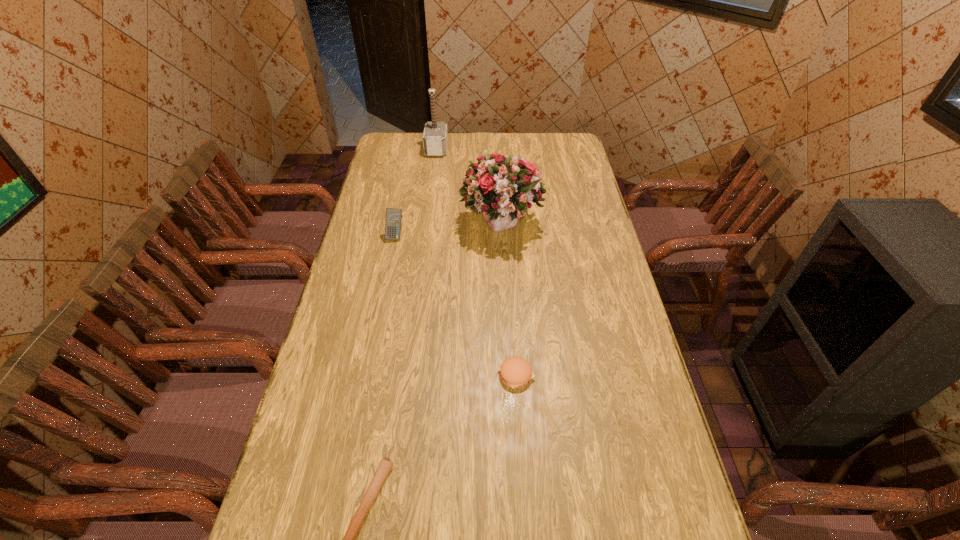
Locate an element on the screen. The width and height of the screenshot is (960, 540). object situated at the far edge is located at coordinates pos(435,137).

Find the location of a particular element. Image resolution: width=960 pixels, height=540 pixels. object that is at the left edge is located at coordinates (393, 219).

Where is `vacant space at the far edge of the desktop`? Image resolution: width=960 pixels, height=540 pixels. vacant space at the far edge of the desktop is located at coordinates (457, 150).

In the image, there is a desktop. Where is `vacant region at the left edge`? Image resolution: width=960 pixels, height=540 pixels. vacant region at the left edge is located at coordinates (293, 498).

Find the location of a particular element. The width and height of the screenshot is (960, 540). vacant space at the right edge is located at coordinates (575, 250).

Image resolution: width=960 pixels, height=540 pixels. In the image, there is a desktop. In order to click on blank space at the far right corner in this screenshot , I will do `click(557, 147)`.

Where is `free space that is in between the second shortest object and the bouquet`? The width and height of the screenshot is (960, 540). free space that is in between the second shortest object and the bouquet is located at coordinates (509, 300).

Where is `vacant area that lies between the calculator and the bouquet`? This screenshot has height=540, width=960. vacant area that lies between the calculator and the bouquet is located at coordinates (448, 231).

The height and width of the screenshot is (540, 960). Identify the location of free space between the third shortest object and the bouquet. (448, 231).

Find the location of a particular element. This screenshot has height=540, width=960. vacant space in between the second nearest object and the third shortest object is located at coordinates (456, 306).